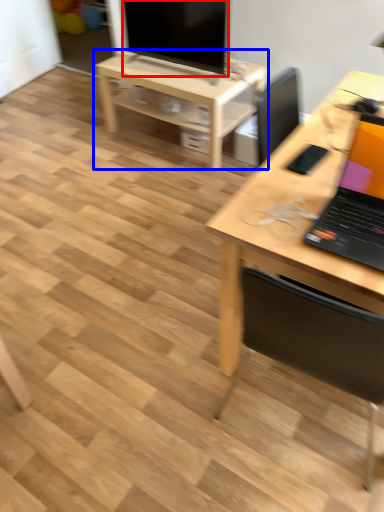
Question: Among these objects, which one is farthest to the camera, television (highlighted by a red box) or table (highlighted by a blue box)?

Choices:
 (A) television
 (B) table

Answer: (B)